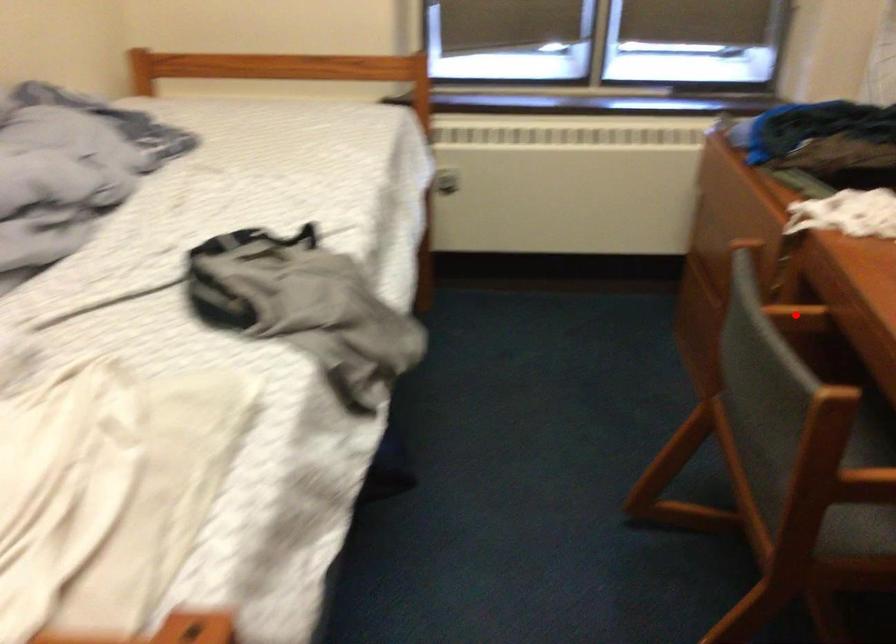
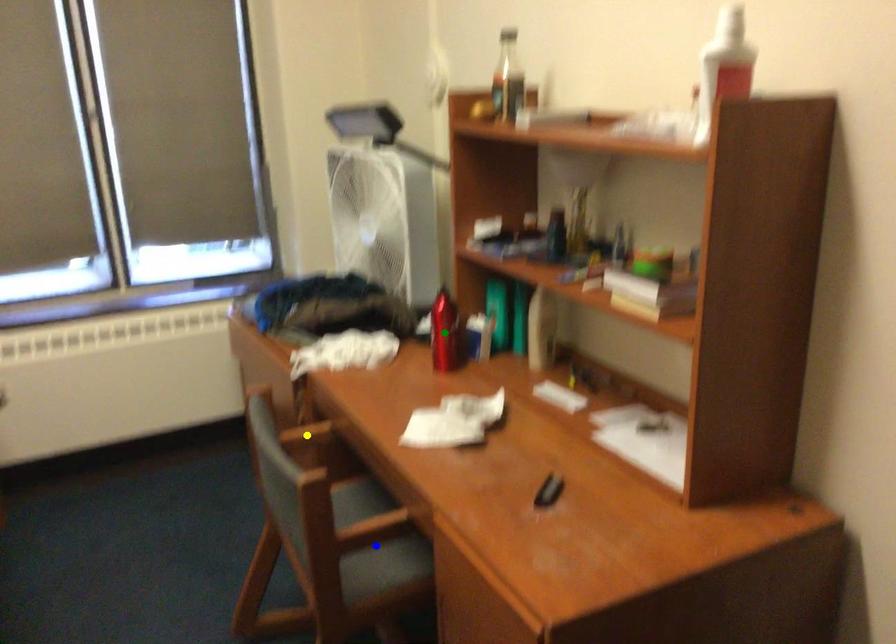
Question: I am providing you with two images of the same scene from different viewpoints. A red point is marked on the first image. You are given multiple points on the second image. Which spot in image 2 lines up with the point in image 1?

Choices:
 (A) blue point
 (B) yellow point
 (C) green point

Answer: (B)